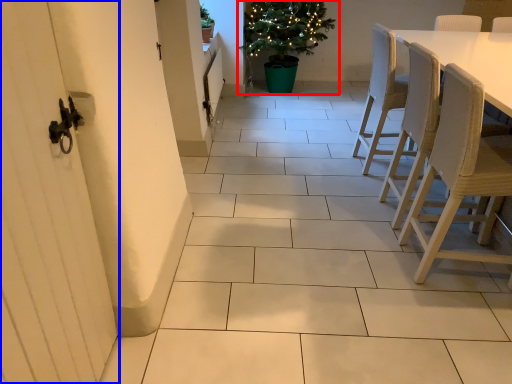
Question: Among these objects, which one is farthest to the camera, houseplant (highlighted by a red box) or screen door (highlighted by a blue box)?

Choices:
 (A) houseplant
 (B) screen door

Answer: (A)